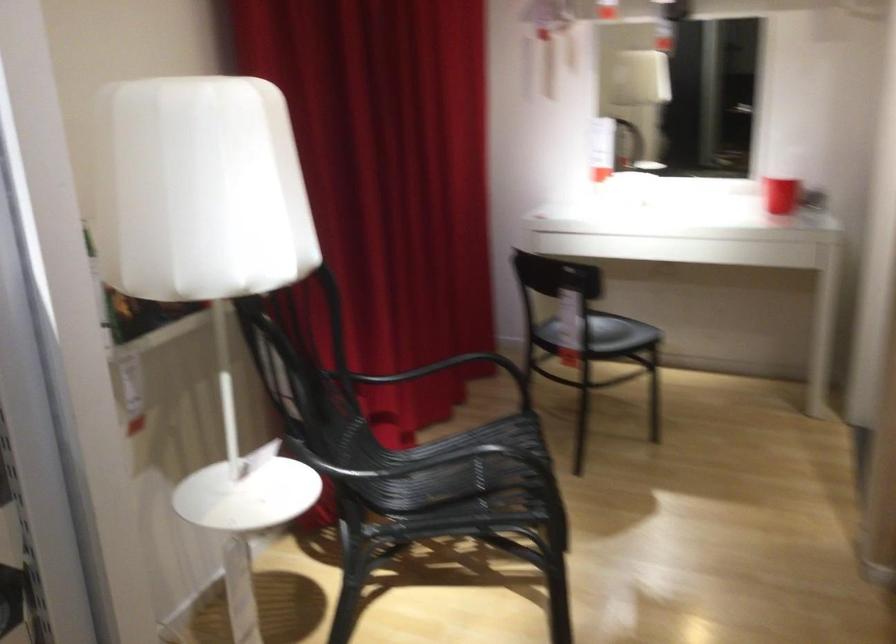
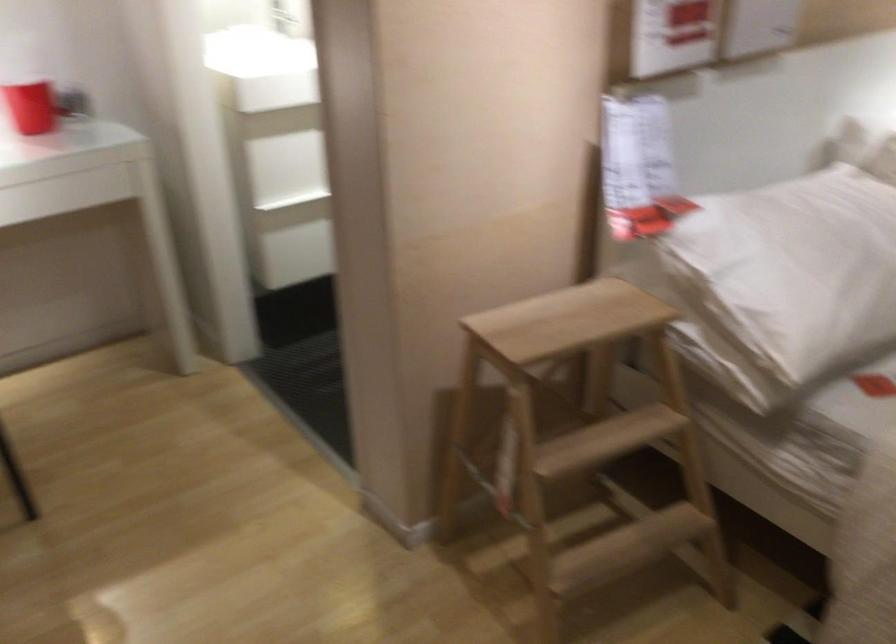
Question: Based on the continuous images, in which direction is the camera rotating? Reply with the corresponding letter.

Choices:
 (A) Left
 (B) Right
 (C) Up
 (D) Down

Answer: (B)